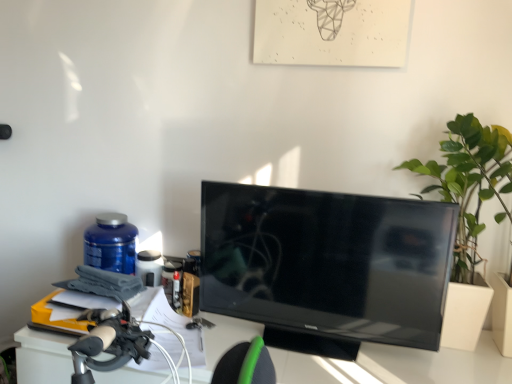
This screenshot has height=384, width=512. In order to click on black glossy tv at center in this screenshot , I will do `click(326, 265)`.

Measure the distance between point (400, 244) and camera.

The depth of point (400, 244) is 3.96 feet.

The image size is (512, 384). In order to click on green leafy plant at right in this screenshot , I will do `click(468, 215)`.

In the scene shown: Considering the sizes of green leafy plant at right and blue plastic bottle at left in the image, is green leafy plant at right taller or shorter than blue plastic bottle at left?

In the image, green leafy plant at right appears to be taller than blue plastic bottle at left.

Based on their sizes in the image, would you say green leafy plant at right is bigger or smaller than blue plastic bottle at left?

green leafy plant at right is bigger than blue plastic bottle at left.

Does point (435, 167) come behind point (91, 244)?

No.

The image size is (512, 384). Find the location of `houseplant that appears on the right of blue plastic bottle at left`. houseplant that appears on the right of blue plastic bottle at left is located at coordinates (468, 215).

I want to click on houseplant located in front of the blue plastic bottle at left, so click(468, 215).

Is blue plastic bottle at left beside green leafy plant at right?

No, blue plastic bottle at left is not with green leafy plant at right.

Based on the photo, from the image's perspective, which one is positioned lower, blue plastic bottle at left or green leafy plant at right?

blue plastic bottle at left appears lower in the image.

From a real-world perspective, which object stands above the other?

green leafy plant at right, from a real-world perspective.

Identify the location of houseplant that appears above the black glossy tv at center (from a real-world perspective). (468, 215).

Which is in front, black glossy tv at center or green leafy plant at right?

black glossy tv at center is closer to the camera.

Which is more to the right, black glossy tv at center or green leafy plant at right?

Positioned to the right is green leafy plant at right.

Do you think black glossy tv at center is within green leafy plant at right, or outside of it?

black glossy tv at center lies outside green leafy plant at right.

Is green leafy plant at right to the left of black glossy tv at center from the viewer's perspective?

In fact, green leafy plant at right is to the right of black glossy tv at center.

From a real-world perspective, is green leafy plant at right on black glossy tv at center?

Yes, from a real-world perspective, green leafy plant at right is over black glossy tv at center

Is green leafy plant at right looking in the opposite direction of black glossy tv at center?

No, black glossy tv at center is not at the back of green leafy plant at right.

Consider the image. Considering the sizes of black glossy tv at center and blue plastic bottle at left in the image, is black glossy tv at center bigger or smaller than blue plastic bottle at left?

black glossy tv at center is bigger than blue plastic bottle at left.

In the scene shown: In the image, is black glossy tv at center on the left side or the right side of blue plastic bottle at left?

In the image, black glossy tv at center appears on the right side of blue plastic bottle at left.

From a real-world perspective, between black glossy tv at center and blue plastic bottle at left, who is vertically lower?

blue plastic bottle at left, from a real-world perspective.

Is black glossy tv at center taller than blue plastic bottle at left?

Yes, black glossy tv at center is taller than blue plastic bottle at left.

The width and height of the screenshot is (512, 384). I want to click on bottle that is on the left side of black glossy tv at center, so click(111, 243).

Which is more to the right, blue plastic bottle at left or black glossy tv at center?

black glossy tv at center is more to the right.

Can you see blue plastic bottle at left touching black glossy tv at center?

There is a gap between blue plastic bottle at left and black glossy tv at center.

How many degrees apart are the facing directions of blue plastic bottle at left and black glossy tv at center?

They differ by 5.88 degrees in their facing directions.

Find the location of a particular element. houseplant in front of the blue plastic bottle at left is located at coordinates point(468,215).

The image size is (512, 384). Identify the location of bottle below the green leafy plant at right (from the image's perspective). (111, 243).

Looking at the image, which one is located further to green leafy plant at right, black glossy tv at center or blue plastic bottle at left?

blue plastic bottle at left is further to green leafy plant at right.

Based on their spatial positions, is blue plastic bottle at left or black glossy tv at center further from green leafy plant at right?

blue plastic bottle at left is further to green leafy plant at right.

Based on their spatial positions, is blue plastic bottle at left or green leafy plant at right further from black glossy tv at center?

Based on the image, blue plastic bottle at left appears to be further to black glossy tv at center.

From the image, which object appears to be nearer to blue plastic bottle at left, green leafy plant at right or black glossy tv at center?

black glossy tv at center is closer to blue plastic bottle at left.

Looking at the image, which one is located closer to black glossy tv at center, green leafy plant at right or blue plastic bottle at left?

Among the two, green leafy plant at right is located nearer to black glossy tv at center.

From the image, which object appears to be nearer to blue plastic bottle at left, black glossy tv at center or green leafy plant at right?

Among the two, black glossy tv at center is located nearer to blue plastic bottle at left.

What are the coordinates of `television located between blue plastic bottle at left and green leafy plant at right in the left-right direction` in the screenshot? It's located at (326, 265).